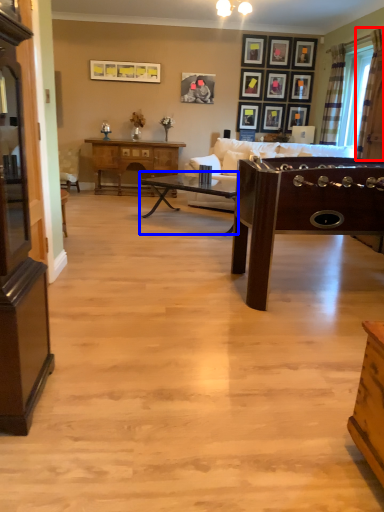
Question: Which of the following is the closest to the observer, curtain (highlighted by a red box) or table (highlighted by a blue box)?

Choices:
 (A) curtain
 (B) table

Answer: (A)